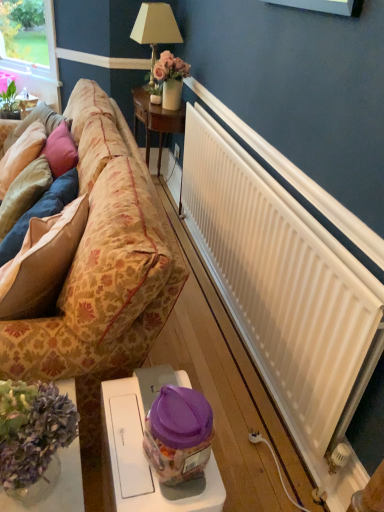
Where is `free spot above white plastic table at lower center, the 2th table ordered from the bottom (from a real-world perspective)`? Image resolution: width=384 pixels, height=512 pixels. free spot above white plastic table at lower center, the 2th table ordered from the bottom (from a real-world perspective) is located at coordinates (142, 421).